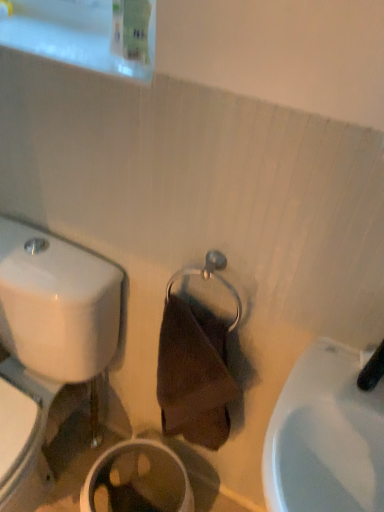
The width and height of the screenshot is (384, 512). Identify the location of white glossy sink at lower right. (325, 437).

Image resolution: width=384 pixels, height=512 pixels. In order to click on white glossy toilet at left in this screenshot , I will do `click(46, 344)`.

Find the location of `white glossy sink at lower right`. white glossy sink at lower right is located at coordinates (325, 437).

Is white glossy toilet at left at the right side of white glossy sink at lower right?

Incorrect, white glossy toilet at left is not on the right side of white glossy sink at lower right.

From a real-world perspective, does white glossy toilet at left sit lower than white glossy sink at lower right?

Yes, from a real-world perspective, white glossy toilet at left is below white glossy sink at lower right.

The width and height of the screenshot is (384, 512). I want to click on toilet lying behind the white glossy sink at lower right, so click(x=46, y=344).

Is white glossy toilet at left located outside white glossy sink at lower right?

Yes.

Between white glossy sink at lower right and black rubber faucet at upper right, which one has smaller size?

Smaller between the two is black rubber faucet at upper right.

From the image's perspective, is white glossy sink at lower right positioned above or below black rubber faucet at upper right?

white glossy sink at lower right is situated lower than black rubber faucet at upper right in the image.

From a real-world perspective, is white glossy sink at lower right physically below black rubber faucet at upper right?

Indeed, from a real-world perspective, white glossy sink at lower right is positioned beneath black rubber faucet at upper right.

Can you confirm if white glossy sink at lower right is taller than black rubber faucet at upper right?

Correct, white glossy sink at lower right is much taller as black rubber faucet at upper right.

Considering the sizes of black rubber faucet at upper right and white glossy sink at lower right in the image, is black rubber faucet at upper right taller or shorter than white glossy sink at lower right?

Considering their sizes, black rubber faucet at upper right has less height than white glossy sink at lower right.

From the image's perspective, which one is positioned higher, black rubber faucet at upper right or white glossy sink at lower right?

black rubber faucet at upper right.

Is white glossy sink at lower right inside black rubber faucet at upper right?

Actually, white glossy sink at lower right is outside black rubber faucet at upper right.

This screenshot has width=384, height=512. In order to click on plumbing fixture on the right of white glossy toilet at left in this screenshot , I will do `click(372, 370)`.

Can you confirm if black rubber faucet at upper right is wider than white glossy toilet at left?

In fact, black rubber faucet at upper right might be narrower than white glossy toilet at left.

From their relative heights in the image, would you say black rubber faucet at upper right is taller or shorter than white glossy toilet at left?

Clearly, black rubber faucet at upper right is shorter compared to white glossy toilet at left.

Between point (375, 370) and point (52, 369), which one is positioned in front?

The point (375, 370) is closer to the camera.

From a real-world perspective, is white glossy toilet at left on top of black rubber faucet at upper right?

No, from a real-world perspective, white glossy toilet at left is not over black rubber faucet at upper right

Is black rubber faucet at upper right completely or partially inside white glossy toilet at left?

No, white glossy toilet at left does not contain black rubber faucet at upper right.

I want to click on plumbing fixture lying above the white glossy toilet at left (from the image's perspective), so click(x=372, y=370).

Is white glossy toilet at left oriented towards black rubber faucet at upper right?

No.

This screenshot has width=384, height=512. Find the location of `sink below the white glossy toilet at left (from the image's perspective)`. sink below the white glossy toilet at left (from the image's perspective) is located at coordinates (325, 437).

Based on the photo, from a real-world perspective, between white glossy sink at lower right and white glossy toilet at left, who is vertically lower?

white glossy toilet at left.

Which object is wider, white glossy sink at lower right or white glossy toilet at left?

white glossy toilet at left is wider.

Is white glossy sink at lower right smaller than white glossy toilet at left?

Correct, white glossy sink at lower right occupies less space than white glossy toilet at left.

Where is `sink above the white glossy toilet at left (from a real-world perspective)`? sink above the white glossy toilet at left (from a real-world perspective) is located at coordinates (325, 437).

The width and height of the screenshot is (384, 512). What are the coordinates of `sink below the black rubber faucet at upper right (from a real-world perspective)` in the screenshot? It's located at (325, 437).

Estimate the real-world distances between objects in this image. Which object is further from black rubber faucet at upper right, white glossy toilet at left or white glossy sink at lower right?

Among the two, white glossy toilet at left is located further to black rubber faucet at upper right.

When comparing their distances from white glossy sink at lower right, does white glossy toilet at left or black rubber faucet at upper right seem further?

white glossy toilet at left is positioned further to the anchor white glossy sink at lower right.

Based on their spatial positions, is black rubber faucet at upper right or white glossy toilet at left closer to white glossy sink at lower right?

black rubber faucet at upper right lies closer to white glossy sink at lower right than the other object.

Estimate the real-world distances between objects in this image. Which object is closer to black rubber faucet at upper right, white glossy sink at lower right or white glossy toilet at left?

white glossy sink at lower right.

Looking at the image, which one is located further to white glossy toilet at left, white glossy sink at lower right or black rubber faucet at upper right?

black rubber faucet at upper right lies further to white glossy toilet at left than the other object.

Which object lies further to the anchor point white glossy toilet at left, black rubber faucet at upper right or white glossy sink at lower right?

black rubber faucet at upper right lies further to white glossy toilet at left than the other object.

You are a GUI agent. You are given a task and a screenshot of the screen. Output one action in this format:
    pyautogui.click(x=<x>, y=<y>)
    Task: Click on the sink between white glossy toilet at left and black rubber faucet at upper right
    This screenshot has width=384, height=512.
    Given the screenshot: What is the action you would take?
    pyautogui.click(x=325, y=437)